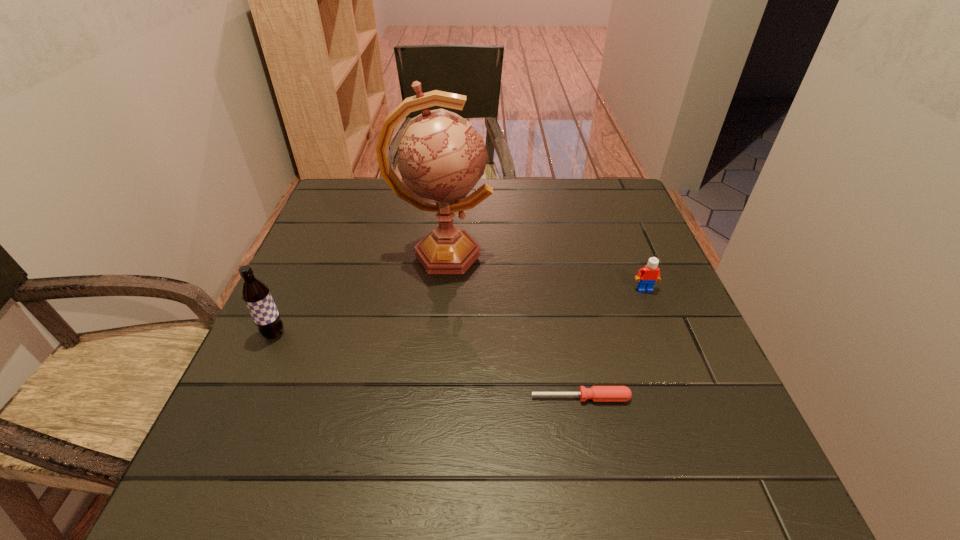
This screenshot has height=540, width=960. Identify the location of object that is the closest one to the root beer. [x=441, y=157].

Where is `object that is the third closest to the third object from right to left`? Image resolution: width=960 pixels, height=540 pixels. object that is the third closest to the third object from right to left is located at coordinates (650, 273).

Find the location of `vacant space that satisfies the following two spatial constraints: 1. on the front-facing side of the nearest object; 2. on the right side of the tallest object`. vacant space that satisfies the following two spatial constraints: 1. on the front-facing side of the nearest object; 2. on the right side of the tallest object is located at coordinates (428, 397).

The width and height of the screenshot is (960, 540). I want to click on free space that satisfies the following two spatial constraints: 1. on the front-facing side of the shortest object; 2. on the left side of the farthest object, so click(x=428, y=397).

You are a GUI agent. You are given a task and a screenshot of the screen. Output one action in this format:
    pyautogui.click(x=<x>, y=<y>)
    Task: Click on the vacant point that satisfies the following two spatial constraints: 1. on the front-facing side of the farthest object; 2. on the back side of the shortest object
    The height and width of the screenshot is (540, 960).
    Given the screenshot: What is the action you would take?
    pyautogui.click(x=428, y=397)